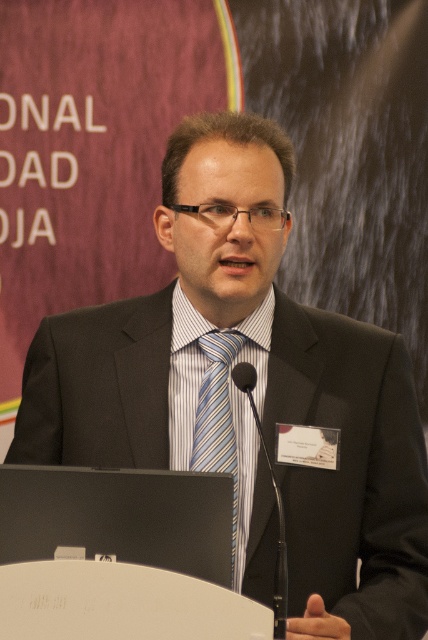
Question: Is striped cotton dress shirt at center below blue striped tie at center?

Choices:
 (A) no
 (B) yes

Answer: (A)

Question: Is striped cotton dress shirt at center thinner than blue striped tie at center?

Choices:
 (A) yes
 (B) no

Answer: (B)

Question: Observing the image, what is the correct spatial positioning of striped cotton dress shirt at center in reference to blue striped tie at center?

Choices:
 (A) left
 (B) right

Answer: (B)

Question: Which of the following is the farthest from the observer?

Choices:
 (A) blue striped tie at center
 (B) striped cotton dress shirt at center

Answer: (B)